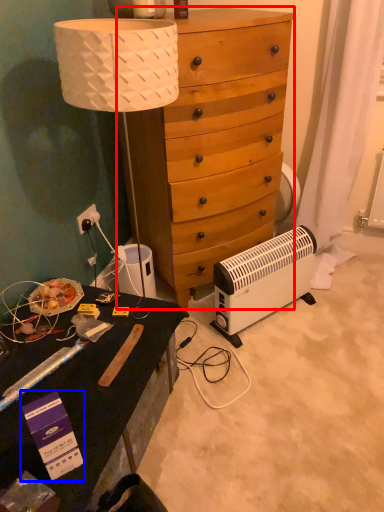
Question: Among these objects, which one is farthest to the camera, dresser (highlighted by a red box) or box (highlighted by a blue box)?

Choices:
 (A) dresser
 (B) box

Answer: (A)